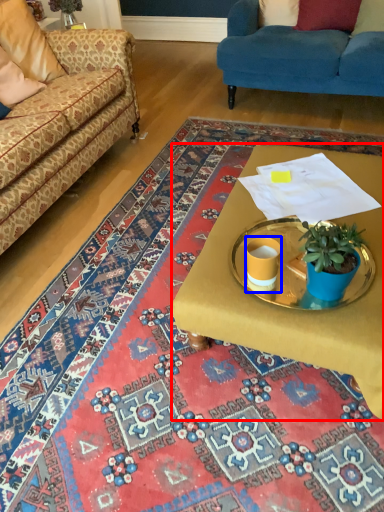
Question: Which of the following is the closest to the observer, desk (highlighted by a red box) or coffee cup (highlighted by a blue box)?

Choices:
 (A) desk
 (B) coffee cup

Answer: (A)